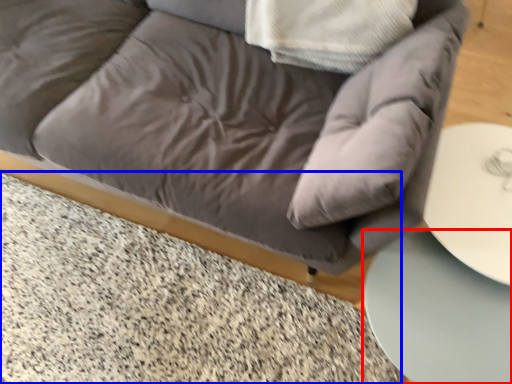
Question: Which point is closer to the camera, table (highlighted by a red box) or marble (highlighted by a blue box)?

Choices:
 (A) table
 (B) marble

Answer: (A)